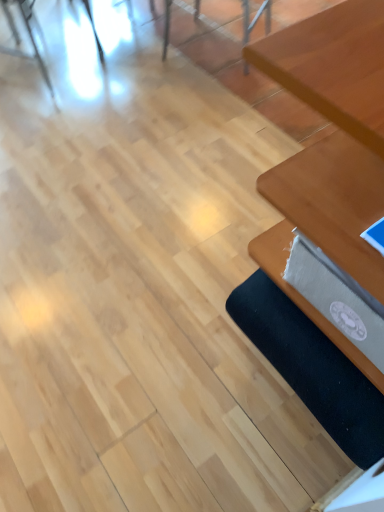
This screenshot has height=512, width=384. I want to click on vacant space in front of metallic silver chair at upper left, which is the 1th chair from left to right, so click(x=54, y=117).